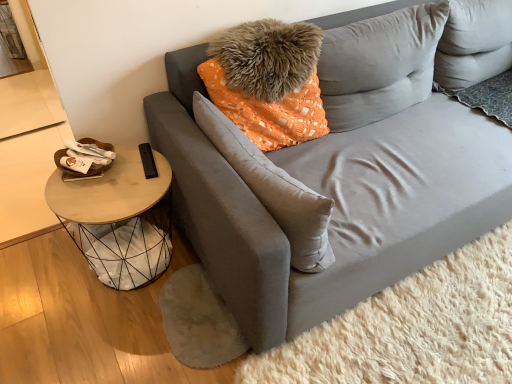
Question: Is suede gray pillow at center, which appears as the second pillow when viewed from the right, thinner than velvety gray pillow at upper right, arranged as the 1th pillow when viewed from the right?

Choices:
 (A) no
 (B) yes

Answer: (B)

Question: Does suede gray pillow at center, marked as the 1th pillow in a left-to-right arrangement, have a greater height compared to velvety gray pillow at upper right, arranged as the 1th pillow when viewed from the right?

Choices:
 (A) yes
 (B) no

Answer: (B)

Question: Can you confirm if suede gray pillow at center, marked as the 1th pillow in a left-to-right arrangement, is positioned to the right of velvety gray pillow at upper right, placed as the 2th pillow when sorted from left to right?

Choices:
 (A) yes
 (B) no

Answer: (B)

Question: Does suede gray pillow at center, which appears as the second pillow when viewed from the right, have a smaller size compared to velvety gray pillow at upper right, arranged as the 1th pillow when viewed from the right?

Choices:
 (A) yes
 (B) no

Answer: (A)

Question: Considering the relative positions of suede gray pillow at center, marked as the 1th pillow in a left-to-right arrangement, and velvety gray pillow at upper right, arranged as the 1th pillow when viewed from the right, in the image provided, is suede gray pillow at center, marked as the 1th pillow in a left-to-right arrangement, in front of velvety gray pillow at upper right, arranged as the 1th pillow when viewed from the right,?

Choices:
 (A) yes
 (B) no

Answer: (A)

Question: From the image's perspective, is suede gray pillow at center, marked as the 1th pillow in a left-to-right arrangement, located above velvety gray pillow at upper right, arranged as the 1th pillow when viewed from the right?

Choices:
 (A) yes
 (B) no

Answer: (B)

Question: Would you say woodenmaterial/texture side table at left is a long distance from velvety gray pillow at upper right, arranged as the 1th pillow when viewed from the right?

Choices:
 (A) no
 (B) yes

Answer: (A)

Question: Is woodenmaterial/texture side table at left at the right side of velvety gray pillow at upper right, arranged as the 1th pillow when viewed from the right?

Choices:
 (A) yes
 (B) no

Answer: (B)

Question: Is woodenmaterial/texture side table at left facing towards velvety gray pillow at upper right, placed as the 2th pillow when sorted from left to right?

Choices:
 (A) no
 (B) yes

Answer: (A)

Question: Does woodenmaterial/texture side table at left have a smaller size compared to velvety gray pillow at upper right, placed as the 2th pillow when sorted from left to right?

Choices:
 (A) no
 (B) yes

Answer: (A)

Question: From the image's perspective, is woodenmaterial/texture side table at left under velvety gray pillow at upper right, arranged as the 1th pillow when viewed from the right?

Choices:
 (A) no
 (B) yes

Answer: (B)

Question: From a real-world perspective, is woodenmaterial/texture side table at left physically above velvety gray pillow at upper right, placed as the 2th pillow when sorted from left to right?

Choices:
 (A) no
 (B) yes

Answer: (A)

Question: From a real-world perspective, is velvet gray couch at center located higher than woodenmaterial/texture side table at left?

Choices:
 (A) no
 (B) yes

Answer: (B)